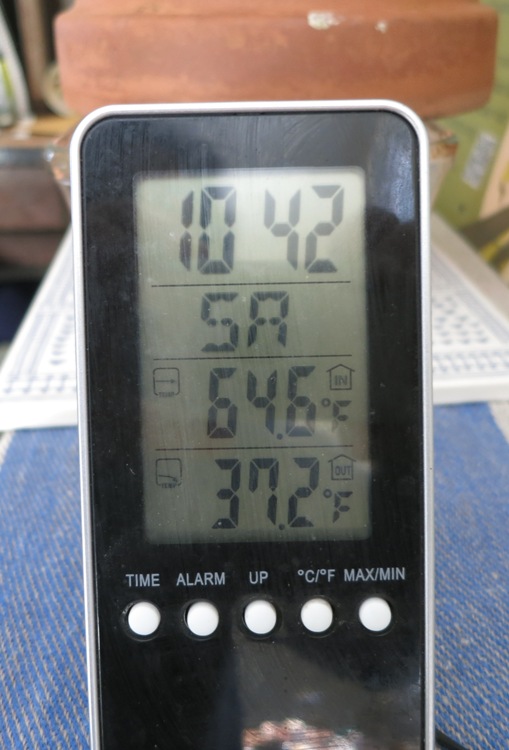
Where is `cushion of some type`? Image resolution: width=509 pixels, height=750 pixels. cushion of some type is located at coordinates (310, 66).